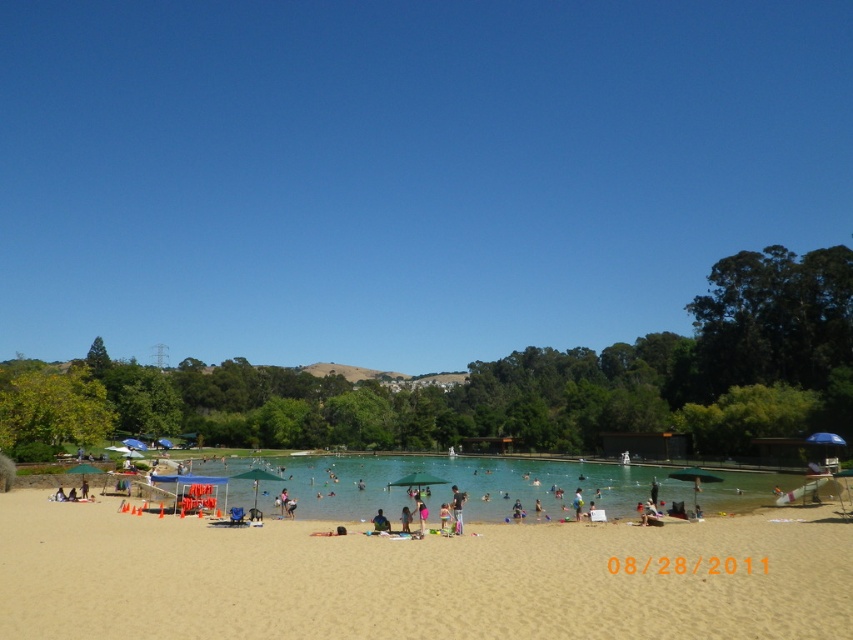
Who is positioned more to the left, fine-grained sand at center or light brown wooden chair at center?

From the viewer's perspective, fine-grained sand at center appears more on the left side.

Is point (723, 605) farther from viewer compared to point (386, 525)?

No, (723, 605) is in front of (386, 525).

Is point (405, 579) farther from camera compared to point (381, 518)?

No.

Where is `fine-grained sand at center`? The height and width of the screenshot is (640, 853). fine-grained sand at center is located at coordinates (415, 579).

How distant is fine-grained sand at center from clear blue water at center?

77.20 feet

Consider the image. Does fine-grained sand at center have a greater height compared to clear blue water at center?

No, fine-grained sand at center is not taller than clear blue water at center.

At what (x,y) coordinates should I click in order to perform the action: click on fine-grained sand at center. Please return your answer as a coordinate pair (x, y). Looking at the image, I should click on (415, 579).

Is transparent blue sky at upper center behind fine-grained sand at center?

Yes.

Is transparent blue sky at upper center wider than fine-grained sand at center?

Indeed, transparent blue sky at upper center has a greater width compared to fine-grained sand at center.

Does point (354, 230) lie in front of point (647, 625)?

No.

Identify the location of transparent blue sky at upper center. Image resolution: width=853 pixels, height=640 pixels. (403, 170).